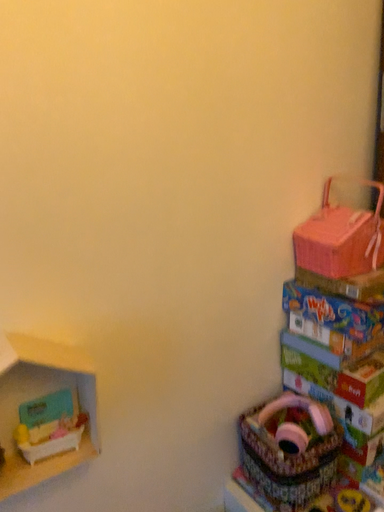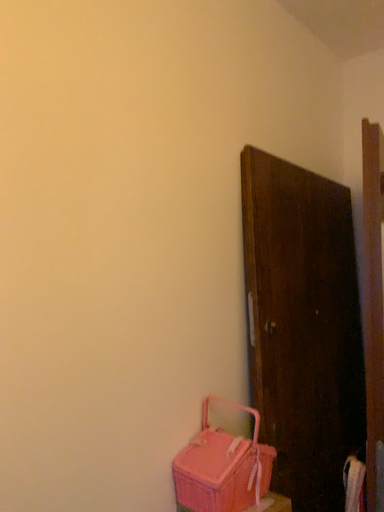
Question: How did the camera likely rotate when shooting the video?

Choices:
 (A) rotated downward
 (B) rotated upward

Answer: (B)